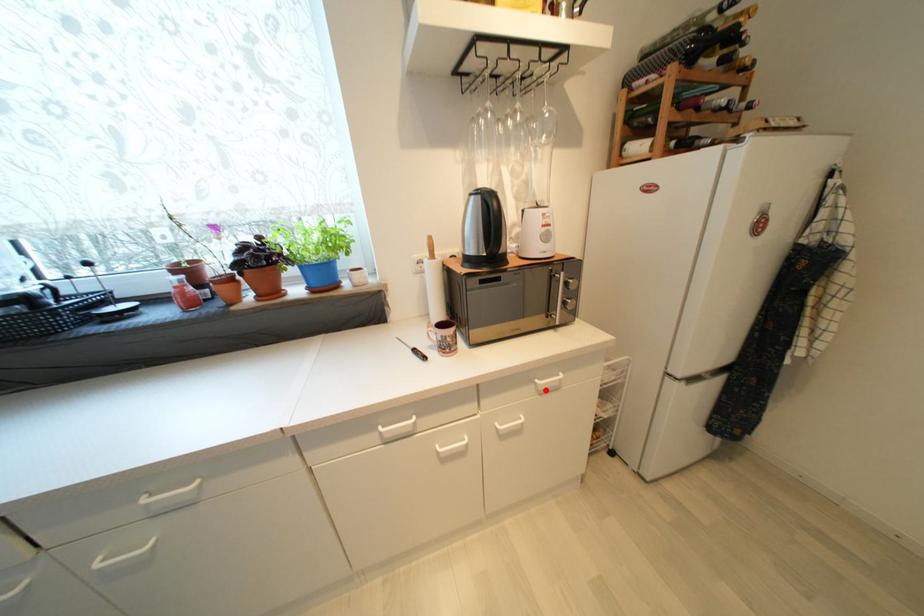
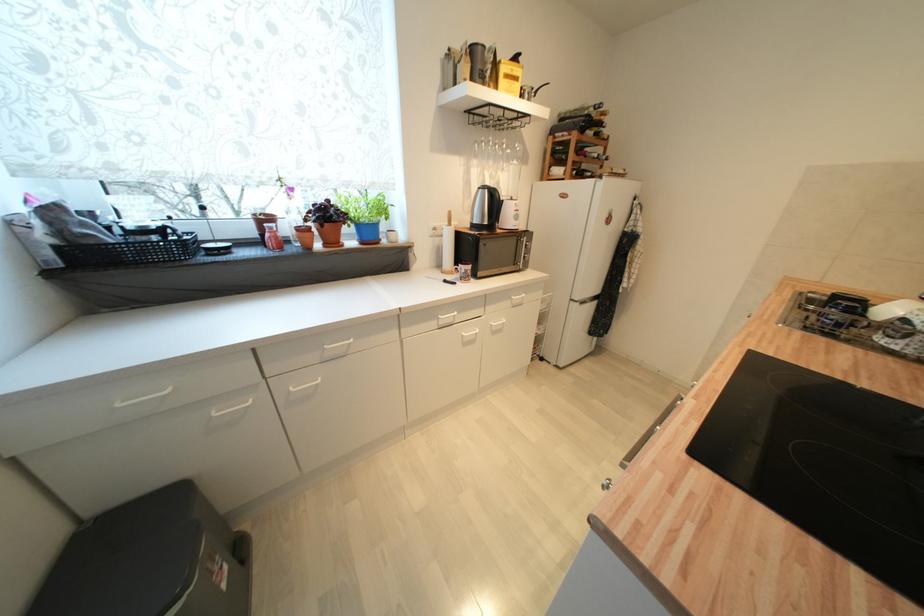
Question: I am providing you with two images of the same scene from different viewpoints. Given a red point in image1, look at the same physical point in image2. Is it:

Choices:
 (A) Closer to the viewpoint
 (B) Farther from the viewpoint

Answer: (A)